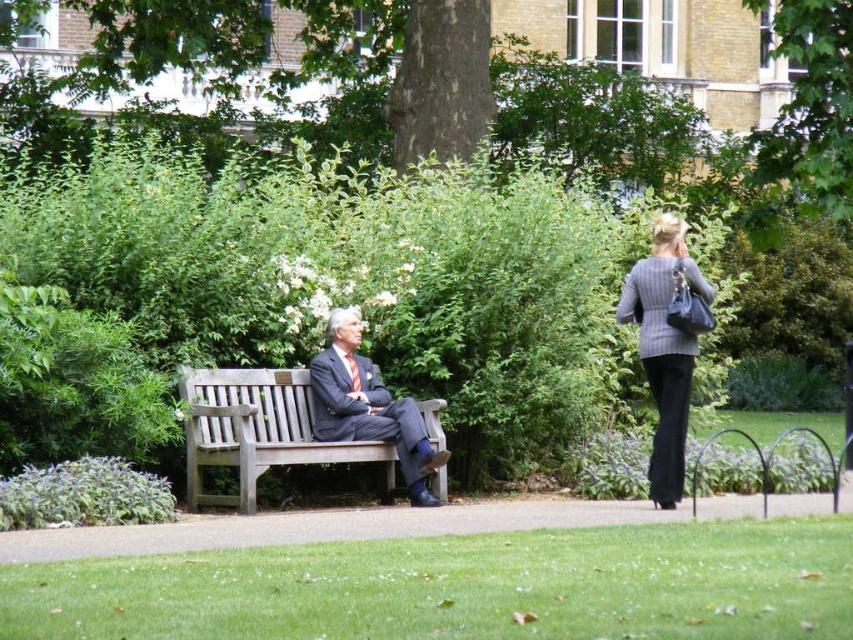
Question: Which object is the closest to the dark gray suit at center?

Choices:
 (A) green leafy tree at center
 (B) green leafy tree at upper right
 (C) wooden bench at center
 (D) knitted gray sweater at right

Answer: (C)

Question: Can you confirm if wooden bench at center is positioned to the right of green leafy tree at upper right?

Choices:
 (A) yes
 (B) no

Answer: (B)

Question: Which of the following is the closest to the observer?

Choices:
 (A) green leafy tree at upper right
 (B) knitted gray sweater at right
 (C) wooden bench at center

Answer: (C)

Question: Does green leafy tree at center come behind knitted gray sweater at right?

Choices:
 (A) no
 (B) yes

Answer: (B)

Question: Which of the following is the farthest from the observer?

Choices:
 (A) wooden bench at center
 (B) green textured tree at center
 (C) knitted gray sweater at right
 (D) green leafy tree at center

Answer: (B)

Question: Is wooden bench at center to the left of dark gray suit at center from the viewer's perspective?

Choices:
 (A) no
 (B) yes

Answer: (B)